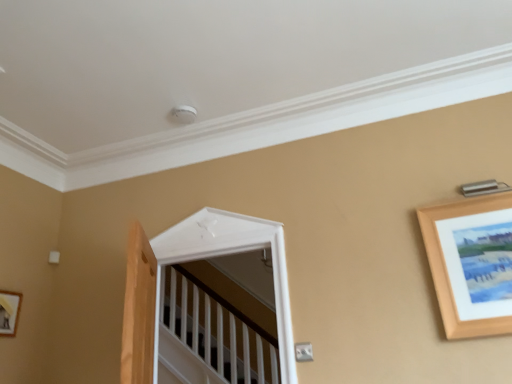
Question: Is point (1, 314) closer or farther from the camera than point (420, 230)?

Choices:
 (A) farther
 (B) closer

Answer: (A)

Question: From a real-world perspective, is wooden picture frame at lower left, which is the first picture frame in back-to-front order, physically located above or below wooden picture frame at upper right, marked as the second picture frame in a back-to-front arrangement?

Choices:
 (A) above
 (B) below

Answer: (B)

Question: Which object is positioned closest to the wooden picture frame at lower left, which is the first picture frame in back-to-front order?

Choices:
 (A) white glossy door at center
 (B) wooden picture frame at upper right, marked as the second picture frame in a back-to-front arrangement

Answer: (A)

Question: Considering the real-world distances, which object is farthest from the wooden picture frame at lower left, positioned as the 2th picture frame in front-to-back order?

Choices:
 (A) wooden picture frame at upper right, the first picture frame in the front-to-back sequence
 (B) white glossy door at center

Answer: (A)